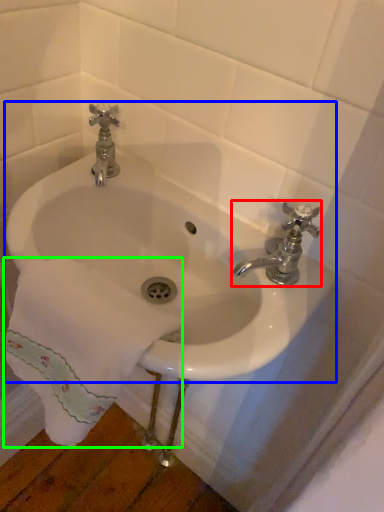
Question: Which object is positioned closest to tap (highlighted by a red box)? Select from sink (highlighted by a blue box) and bath towel (highlighted by a green box).

Choices:
 (A) sink
 (B) bath towel

Answer: (A)